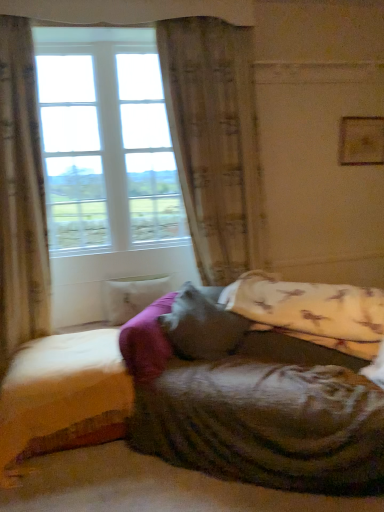
This screenshot has width=384, height=512. I want to click on beige textured curtain at left, acting as the first curtain starting from the left, so click(x=21, y=197).

The height and width of the screenshot is (512, 384). Describe the element at coordinates (132, 296) in the screenshot. I see `white marble pillow at center, which is counted as the second pillow, starting from the front` at that location.

Identify the location of clear glass window at upper left. (106, 142).

The height and width of the screenshot is (512, 384). What do you see at coordinates (201, 326) in the screenshot? I see `velvety gray pillow at center, which appears as the 2th pillow when viewed from the back` at bounding box center [201, 326].

This screenshot has width=384, height=512. In order to click on beige textured curtain at left, placed as the second curtain when sorted from right to left in this screenshot , I will do `click(21, 197)`.

From a real-world perspective, between clear glass window at upper left and wooden bed frame at lower left, who is vertically higher?

clear glass window at upper left.

Which object is thinner, clear glass window at upper left or wooden bed frame at lower left?

With smaller width is clear glass window at upper left.

From the picture: Who is bigger, clear glass window at upper left or wooden bed frame at lower left?

clear glass window at upper left.

Is point (142, 76) closer or farther from the camera than point (44, 357)?

Clearly, point (142, 76) is more distant from the camera than point (44, 357).

Is wooden bed frame at lower left not near velvety gray pillow at center, which is counted as the 1th pillow, starting from the right?

Actually, wooden bed frame at lower left and velvety gray pillow at center, which is counted as the 1th pillow, starting from the right, are a little close together.

Considering the sizes of objects wooden bed frame at lower left and velvety gray pillow at center, which appears as the 2th pillow when viewed from the back, in the image provided, who is shorter, wooden bed frame at lower left or velvety gray pillow at center, which appears as the 2th pillow when viewed from the back,?

velvety gray pillow at center, which appears as the 2th pillow when viewed from the back.

Is wooden bed frame at lower left closer to the viewer compared to velvety gray pillow at center, which is counted as the 1th pillow, starting from the right?

Yes, wooden bed frame at lower left is in front of velvety gray pillow at center, which is counted as the 1th pillow, starting from the right.

From a real-world perspective, is wooden bed frame at lower left located beneath velvety gray pillow at center, which is counted as the 1th pillow, starting from the right?

Yes, from a real-world perspective, wooden bed frame at lower left is below velvety gray pillow at center, which is counted as the 1th pillow, starting from the right.

Does velvety gray pillow at center, the 1th pillow from the front, have a greater width compared to white marble pillow at center, the first pillow when ordered from back to front?

Correct, the width of velvety gray pillow at center, the 1th pillow from the front, exceeds that of white marble pillow at center, the first pillow when ordered from back to front.

You are a GUI agent. You are given a task and a screenshot of the screen. Output one action in this format:
    pyautogui.click(x=<x>, y=<y>)
    Task: Click on the pillow above the velvety gray pillow at center, which is counted as the 1th pillow, starting from the right (from the image's perspective)
    Image resolution: width=384 pixels, height=512 pixels.
    Given the screenshot: What is the action you would take?
    pyautogui.click(x=132, y=296)

Which of these two, velvety gray pillow at center, which appears as the 2th pillow when viewed from the back, or white marble pillow at center, which is counted as the second pillow, starting from the front, is bigger?

Bigger between the two is velvety gray pillow at center, which appears as the 2th pillow when viewed from the back.

From the picture: Is velvety gray pillow at center, the 1th pillow from the front, next to white marble pillow at center, which is counted as the second pillow, starting from the front, and touching it?

No, velvety gray pillow at center, the 1th pillow from the front, is not touching white marble pillow at center, which is counted as the second pillow, starting from the front.

Does point (202, 228) appear closer or farther from the camera than point (75, 32)?

Point (202, 228) is farther from the camera than point (75, 32).

Looking at their sizes, would you say beige textured curtain at center, marked as the 1th curtain in a right-to-left arrangement, is wider or thinner than clear glass window at upper left?

Clearly, beige textured curtain at center, marked as the 1th curtain in a right-to-left arrangement, has less width compared to clear glass window at upper left.

Which is behind, wooden bed frame at lower left or beige textured curtain at left, placed as the second curtain when sorted from right to left?

beige textured curtain at left, placed as the second curtain when sorted from right to left, is behind.

Considering the positions of objects wooden bed frame at lower left and beige textured curtain at left, placed as the second curtain when sorted from right to left, in the image provided, who is more to the right, wooden bed frame at lower left or beige textured curtain at left, placed as the second curtain when sorted from right to left,?

wooden bed frame at lower left.

Is point (8, 468) less distant than point (41, 196)?

Yes, it is.

Is wooden bed frame at lower left smaller than beige textured curtain at left, placed as the second curtain when sorted from right to left?

Yes.

Is velvety gray pillow at center, which appears as the 2th pillow when viewed from the back, touching beige textured curtain at left, acting as the first curtain starting from the left?

No, velvety gray pillow at center, which appears as the 2th pillow when viewed from the back, is not in contact with beige textured curtain at left, acting as the first curtain starting from the left.

Does velvety gray pillow at center, which is the 2th pillow in left-to-right order, come behind beige textured curtain at left, acting as the first curtain starting from the left?

Yes, velvety gray pillow at center, which is the 2th pillow in left-to-right order, is behind beige textured curtain at left, acting as the first curtain starting from the left.

From the image's perspective, which curtain is the 1st one above the velvety gray pillow at center, which appears as the 2th pillow when viewed from the back? Please provide its 2D coordinates.

[(21, 197)]

What's the angular difference between velvety gray pillow at center, which is counted as the 1th pillow, starting from the right, and beige textured curtain at left, acting as the first curtain starting from the left,'s facing directions?

The angle between the facing direction of velvety gray pillow at center, which is counted as the 1th pillow, starting from the right, and the facing direction of beige textured curtain at left, acting as the first curtain starting from the left, is 53.9 degrees.

From the image's perspective, which is below, white marble pillow at center, placed as the second pillow when sorted from right to left, or clear glass window at upper left?

From the image's view, white marble pillow at center, placed as the second pillow when sorted from right to left, is below.

Where is `window that is above the white marble pillow at center, which is counted as the second pillow, starting from the front (from a real-world perspective)`? The height and width of the screenshot is (512, 384). window that is above the white marble pillow at center, which is counted as the second pillow, starting from the front (from a real-world perspective) is located at coordinates (106, 142).

From a real-world perspective, which object rests below the other?

From a 3D spatial view, white marble pillow at center, which is counted as the second pillow, starting from the front, is below.

Does point (145, 303) come closer to viewer compared to point (54, 73)?

No, it is not.

Where is `bed frame in front of the clear glass window at upper left`? The width and height of the screenshot is (384, 512). bed frame in front of the clear glass window at upper left is located at coordinates (63, 396).

What are the coordinates of `bed frame that is on the left side of velvety gray pillow at center, which appears as the 2th pillow when viewed from the back` in the screenshot? It's located at (63, 396).

Looking at the image, which one is located further to white marble pillow at center, the 1th pillow positioned from the left, beige textured curtain at center, which appears as the second curtain when viewed from the left, or beige textured curtain at left, placed as the second curtain when sorted from right to left?

Among the two, beige textured curtain at center, which appears as the second curtain when viewed from the left, is located further to white marble pillow at center, the 1th pillow positioned from the left.

When comparing their distances from wooden bed frame at lower left, does beige textured curtain at left, placed as the second curtain when sorted from right to left, or clear glass window at upper left seem closer?

beige textured curtain at left, placed as the second curtain when sorted from right to left, lies closer to wooden bed frame at lower left than the other object.

When comparing their distances from white marble pillow at center, placed as the second pillow when sorted from right to left, does clear glass window at upper left or wooden bed frame at lower left seem closer?

wooden bed frame at lower left lies closer to white marble pillow at center, placed as the second pillow when sorted from right to left, than the other object.

Looking at the image, which one is located closer to beige textured curtain at left, acting as the first curtain starting from the left, wooden bed frame at lower left or white marble pillow at center, placed as the second pillow when sorted from right to left?

Based on the image, wooden bed frame at lower left appears to be nearer to beige textured curtain at left, acting as the first curtain starting from the left.

Looking at the image, which one is located further to white marble pillow at center, the first pillow when ordered from back to front, beige textured curtain at center, which appears as the second curtain when viewed from the left, or velvety gray pillow at center, which appears as the 2th pillow when viewed from the back?

Among the two, beige textured curtain at center, which appears as the second curtain when viewed from the left, is located further to white marble pillow at center, the first pillow when ordered from back to front.

Estimate the real-world distances between objects in this image. Which object is further from velvety gray pillow at center, which is the 2th pillow in left-to-right order, beige textured curtain at left, placed as the second curtain when sorted from right to left, or white marble pillow at center, the first pillow when ordered from back to front?

Based on the image, beige textured curtain at left, placed as the second curtain when sorted from right to left, appears to be further to velvety gray pillow at center, which is the 2th pillow in left-to-right order.

When comparing their distances from white marble pillow at center, placed as the second pillow when sorted from right to left, does wooden bed frame at lower left or clear glass window at upper left seem closer?

wooden bed frame at lower left lies closer to white marble pillow at center, placed as the second pillow when sorted from right to left, than the other object.

When comparing their distances from velvety gray pillow at center, which appears as the 2th pillow when viewed from the back, does wooden bed frame at lower left or beige textured curtain at left, placed as the second curtain when sorted from right to left, seem further?

beige textured curtain at left, placed as the second curtain when sorted from right to left, is positioned further to the anchor velvety gray pillow at center, which appears as the 2th pillow when viewed from the back.

Find the location of `pillow between wooden bed frame at lower left and white marble pillow at center, which is counted as the second pillow, starting from the front, along the z-axis`. pillow between wooden bed frame at lower left and white marble pillow at center, which is counted as the second pillow, starting from the front, along the z-axis is located at coordinates (201, 326).

Where is `pillow between clear glass window at upper left and velvety gray pillow at center, which is the 2th pillow in left-to-right order, vertically`? The image size is (384, 512). pillow between clear glass window at upper left and velvety gray pillow at center, which is the 2th pillow in left-to-right order, vertically is located at coordinates (132, 296).

I want to click on curtain between beige textured curtain at center, which appears as the second curtain when viewed from the left, and wooden bed frame at lower left in the up-down direction, so (21, 197).

Image resolution: width=384 pixels, height=512 pixels. Identify the location of bed frame situated between beige textured curtain at left, placed as the second curtain when sorted from right to left, and velvety gray pillow at center, which is the 2th pillow in left-to-right order, from left to right. (63, 396).